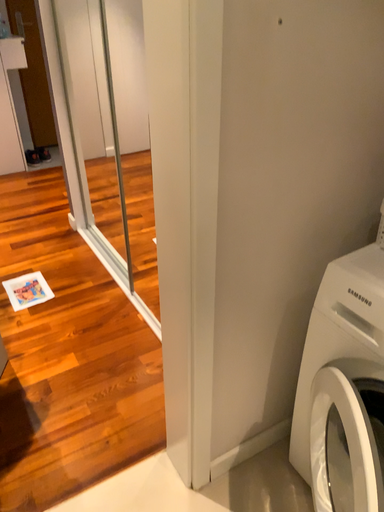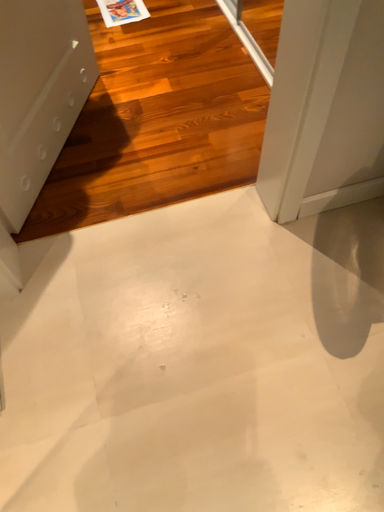
Question: How did the camera likely rotate when shooting the video?

Choices:
 (A) rotated downward
 (B) rotated upward

Answer: (A)